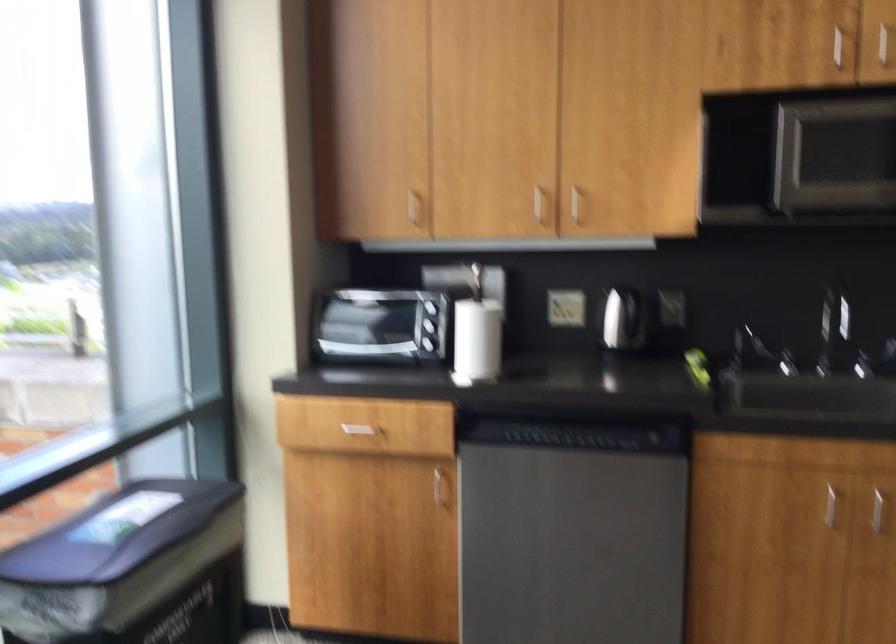
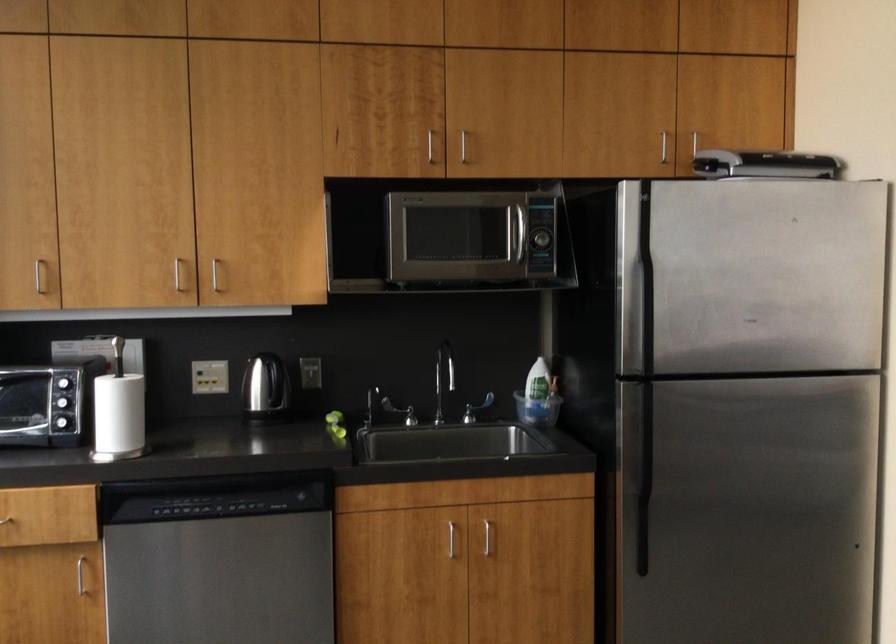
Locate, in the second image, the point that corresponds to [627,324] in the first image.

(266, 391)